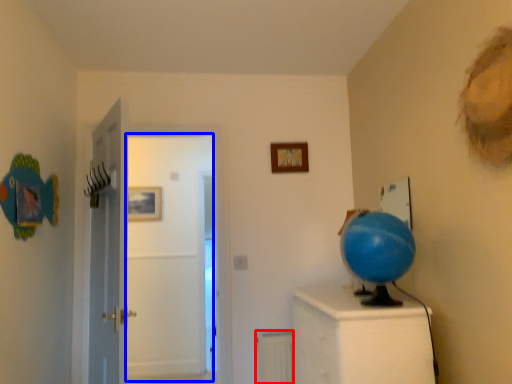
Question: Which object appears closest to the camera in this image, radiator (highlighted by a red box) or door (highlighted by a blue box)?

Choices:
 (A) radiator
 (B) door

Answer: (B)